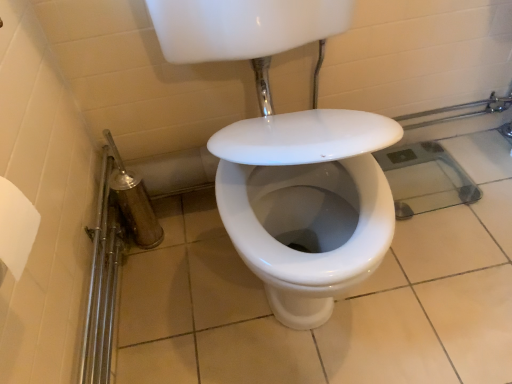
Find the location of a particular element. The height and width of the screenshot is (384, 512). vacant area that is in front of shiny metallic shower at lower left is located at coordinates (157, 279).